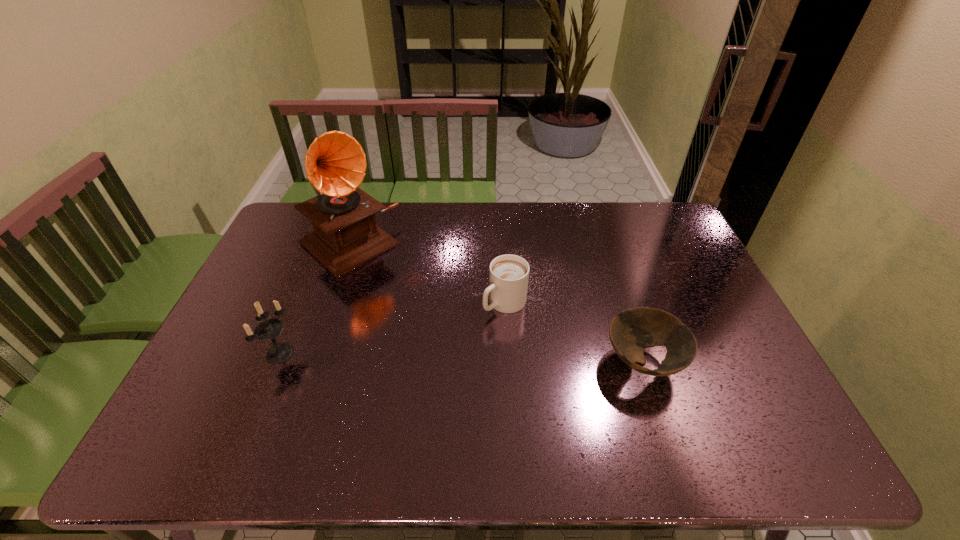
In the image, there is a desktop. What are the coordinates of `vacant space at the far edge` in the screenshot? It's located at pyautogui.click(x=435, y=201).

This screenshot has width=960, height=540. What are the coordinates of `vacant space at the near edge` in the screenshot? It's located at (630, 396).

This screenshot has height=540, width=960. Identify the location of vacant space at the left edge of the desktop. (293, 278).

In the image, there is a desktop. Identify the location of free space at the right edge. The height and width of the screenshot is (540, 960). (660, 252).

In the image, there is a desktop. Where is `free region at the far right corner`? The height and width of the screenshot is (540, 960). free region at the far right corner is located at coordinates (660, 234).

Where is `vacant area between the second tallest object and the tallest object`? This screenshot has width=960, height=540. vacant area between the second tallest object and the tallest object is located at coordinates (315, 299).

Where is `vacant space in between the cappuccino and the tallest object`? vacant space in between the cappuccino and the tallest object is located at coordinates (427, 274).

At what (x,y) coordinates should I click in order to perform the action: click on empty space between the shortest object and the third shortest object. Please return your answer as a coordinate pair (x, y). This screenshot has width=960, height=540. Looking at the image, I should click on (462, 357).

Locate an element on the screen. free space between the bowl and the candle holder is located at coordinates (462, 357).

This screenshot has height=540, width=960. What are the coordinates of `unoccupied area between the third shortest object and the rightmost object` in the screenshot? It's located at (462, 357).